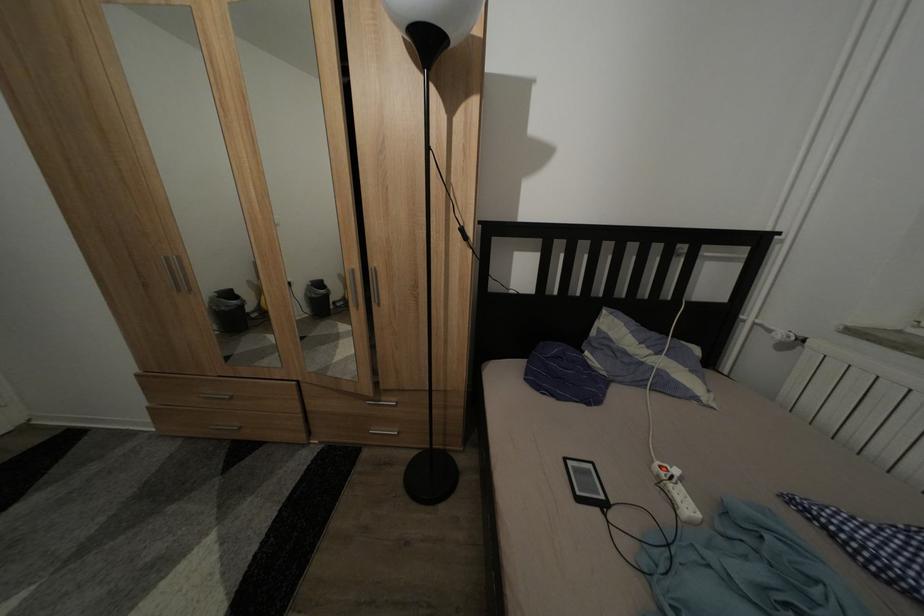
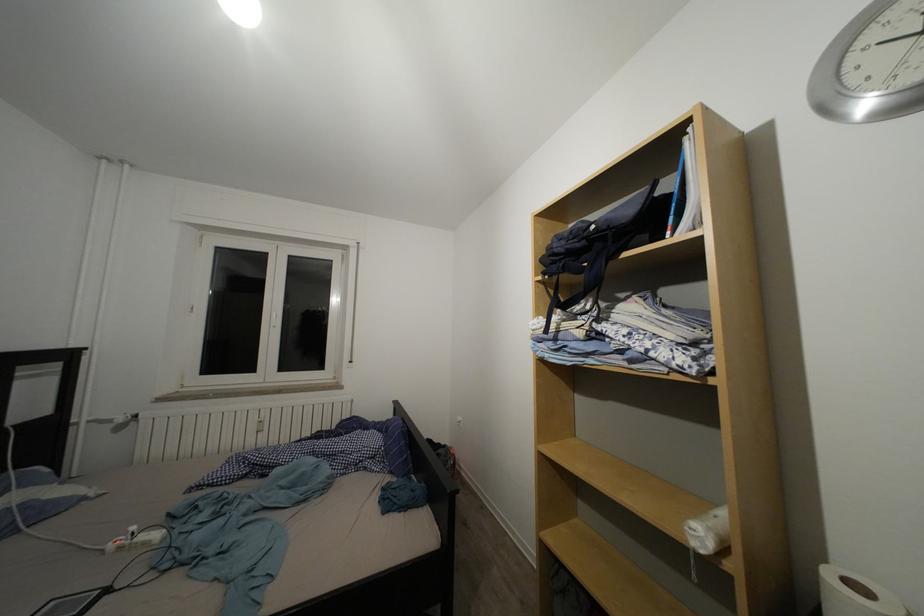
Find the pixel in the second image that matches point (598, 472) in the first image.

(61, 610)